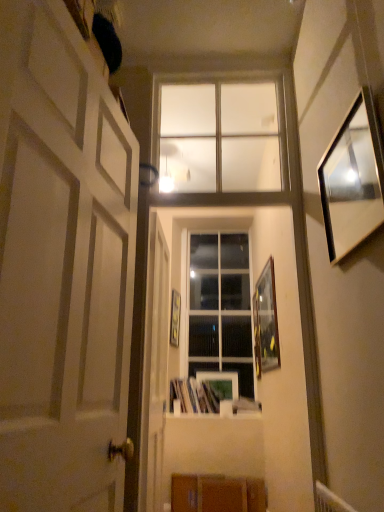
Question: Which direction should I rotate to look at matte wooden picture frame at center, placed as the 3th picture frame when sorted from right to left?

Choices:
 (A) left
 (B) right

Answer: (B)

Question: Is white matte door at left, the second door in the back-to-front sequence, oriented away from matte wooden picture frame at center, placed as the 3th picture frame when sorted from right to left?

Choices:
 (A) yes
 (B) no

Answer: (B)

Question: Is the depth of white matte door at left, which appears as the first door when viewed from the front, less than that of matte wooden picture frame at center, marked as the 4th picture frame in a front-to-back arrangement?

Choices:
 (A) yes
 (B) no

Answer: (A)

Question: Considering the relative sizes of white matte door at left, the second door in the back-to-front sequence, and matte wooden picture frame at center, the first picture frame viewed from the back, in the image provided, is white matte door at left, the second door in the back-to-front sequence, smaller than matte wooden picture frame at center, the first picture frame viewed from the back,?

Choices:
 (A) no
 (B) yes

Answer: (A)

Question: From the image's perspective, would you say white matte door at left, which appears as the first door when viewed from the front, is shown under matte wooden picture frame at center, placed as the 3th picture frame when sorted from right to left?

Choices:
 (A) yes
 (B) no

Answer: (B)

Question: Is white matte door at left, the second door in the back-to-front sequence, wider than matte wooden picture frame at center, marked as the 4th picture frame in a front-to-back arrangement?

Choices:
 (A) no
 (B) yes

Answer: (B)

Question: Is white matte door at left, the second door in the back-to-front sequence, to the left of matte wooden picture frame at center, marked as the 4th picture frame in a front-to-back arrangement, from the viewer's perspective?

Choices:
 (A) no
 (B) yes

Answer: (B)

Question: Is matte wooden picture frame at center, marked as the 4th picture frame in a front-to-back arrangement, positioned beyond the bounds of wooden at lower center?

Choices:
 (A) no
 (B) yes

Answer: (B)

Question: Does matte wooden picture frame at center, the 2th picture frame when ordered from left to right, have a lesser width compared to wooden at lower center?

Choices:
 (A) yes
 (B) no

Answer: (A)

Question: Is matte wooden picture frame at center, marked as the 4th picture frame in a front-to-back arrangement, bigger than wooden at lower center?

Choices:
 (A) yes
 (B) no

Answer: (B)

Question: From a real-world perspective, is matte wooden picture frame at center, the 2th picture frame when ordered from left to right, on top of wooden at lower center?

Choices:
 (A) no
 (B) yes

Answer: (B)

Question: From a real-world perspective, is matte wooden picture frame at center, the first picture frame viewed from the back, below wooden at lower center?

Choices:
 (A) no
 (B) yes

Answer: (A)

Question: Is matte wooden picture frame at center, placed as the 3th picture frame when sorted from right to left, far away from wooden at lower center?

Choices:
 (A) yes
 (B) no

Answer: (B)

Question: From the image's perspective, is wooden picture frame at center, the 1th picture frame viewed from the left, under clear glass window at upper center, placed as the 1th window when sorted from top to bottom?

Choices:
 (A) yes
 (B) no

Answer: (A)